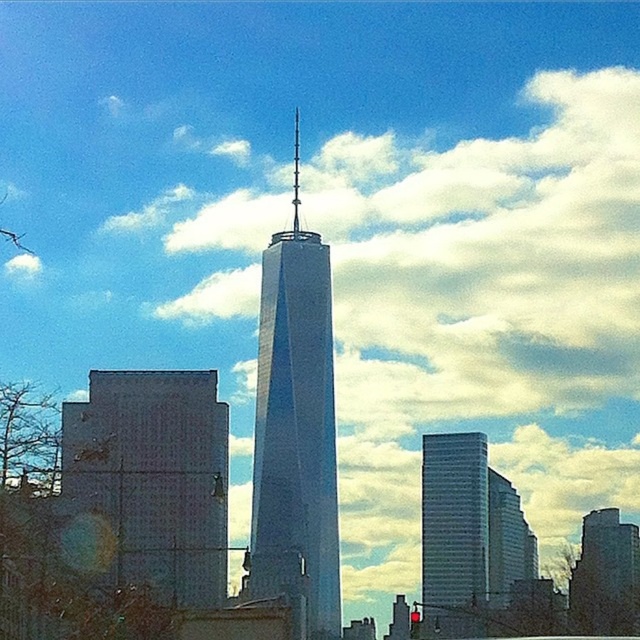
Consider the image. You are standing at the observation deck of the glassy white skyscraper at center. You want to take a photo of the shorter, more boxy building with a textured surface to the left. Given that the camera can focus on objects up to 600 meters away, will you be able to capture a clear image of the shorter building?

The glassy white skyscraper at center is 649.19 meters from camera. Since the camera can focus on objects up to 600 meters away, the distance is beyond the camera focus limit. Therefore, you won not be able to capture a clear image of the shorter, more boxy building with a textured surface to the left.

You are an architect observing the urban skyline. You notice the glassy white skyscraper at center and the dark gray stone tower at center. Which one is positioned higher in the image?

The glassy white skyscraper at center is positioned higher than the dark gray stone tower at center in the image.